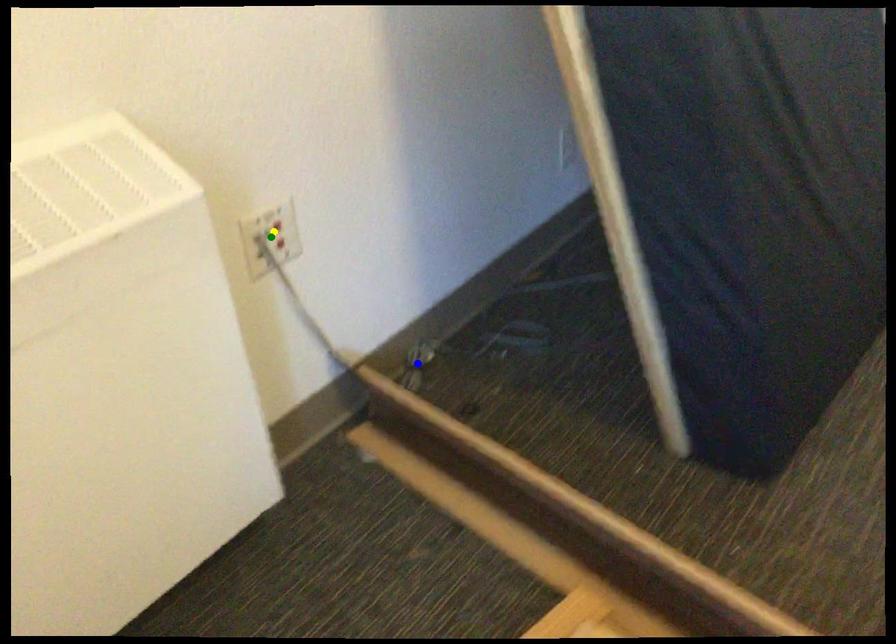
Order these from nearest to farthest:
1. blue point
2. green point
3. yellow point

yellow point < green point < blue point